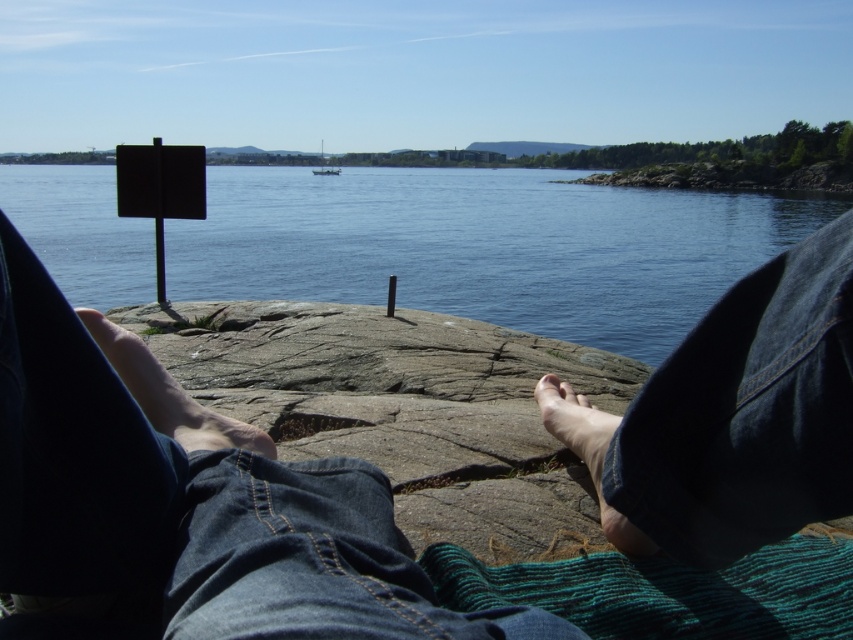
Does smooth skin foot at lower right have a greater width compared to white plastic boat at center?

In fact, smooth skin foot at lower right might be narrower than white plastic boat at center.

Can you confirm if smooth skin foot at lower right is positioned to the right of white plastic boat at center?

Yes, smooth skin foot at lower right is to the right of white plastic boat at center.

Is point (573, 412) less distant than point (317, 173)?

Yes, it is.

Image resolution: width=853 pixels, height=640 pixels. In order to click on smooth skin foot at lower right in this screenshot , I will do `click(590, 460)`.

Is pink flesh at center bigger than matte skin toe at lower center?

No, pink flesh at center is not bigger than matte skin toe at lower center.

Is pink flesh at center further to the viewer compared to matte skin toe at lower center?

Yes, pink flesh at center is behind matte skin toe at lower center.

I want to click on pink flesh at center, so click(x=549, y=384).

Does white wooden boat at center lie in front of matte skin toe at lower center?

No, it is behind matte skin toe at lower center.

Which is below, white wooden boat at center or matte skin toe at lower center?

matte skin toe at lower center is below.

Is point (325, 172) positioned before point (577, 403)?

No, (325, 172) is further to viewer.

Where is `white wooden boat at center`? The height and width of the screenshot is (640, 853). white wooden boat at center is located at coordinates (326, 170).